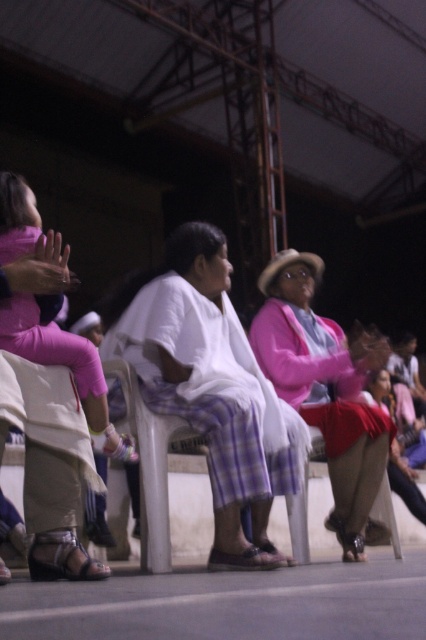
Question: Estimate the real-world distances between objects in this image. Which object is closer to the pink fabric pants at left?

Choices:
 (A) brown leather sandal at lower center
 (B) white cotton dress at center
 (C) pink fabric jacket at center

Answer: (B)

Question: Which object is farther from the camera taking this photo?

Choices:
 (A) pink fabric pants at left
 (B) white cotton dress at center
 (C) white leather sandal at lower left
 (D) pink fabric jacket at center

Answer: (D)

Question: Based on their relative distances, which object is nearer to the pink fabric jacket at center?

Choices:
 (A) pink fabric pants at left
 (B) brown leather sandal at lower center

Answer: (B)

Question: Is pink fabric jacket at center above white leather sandal at lower left?

Choices:
 (A) yes
 (B) no

Answer: (A)

Question: Can you confirm if white cotton dress at center is positioned to the left of brown leather sandal at lower center?

Choices:
 (A) no
 (B) yes

Answer: (B)

Question: Is white cotton dress at center wider than pink fabric pants at left?

Choices:
 (A) yes
 (B) no

Answer: (A)